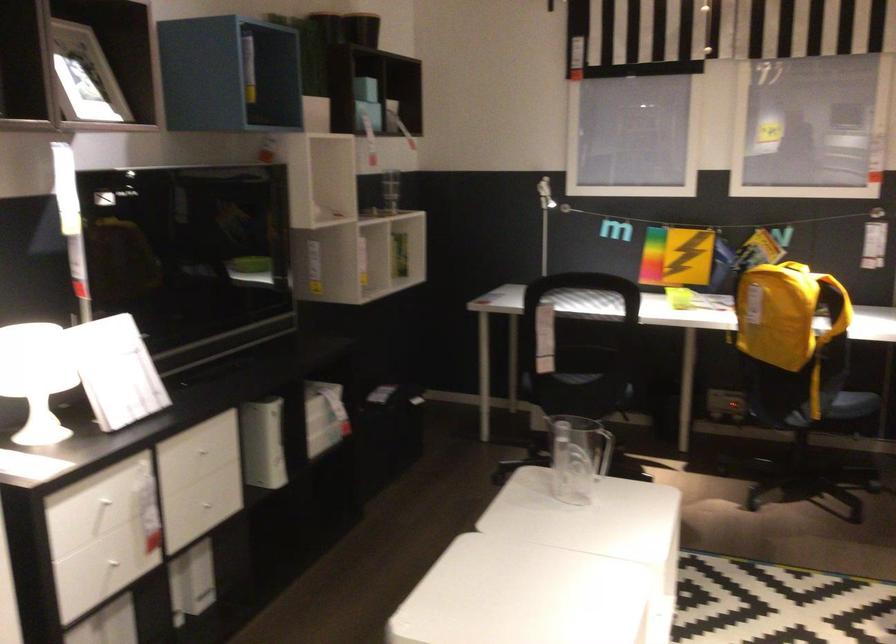
Find where to lift the yellow backpack handle. Please return your answer as a coordinate pair (x, y).

(834, 308)